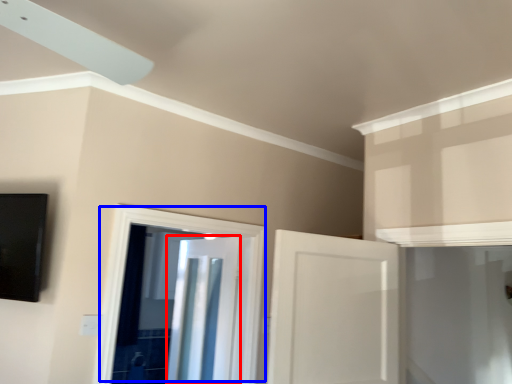
Question: Which point is further to the camera, door (highlighted by a red box) or door (highlighted by a blue box)?

Choices:
 (A) door
 (B) door

Answer: (A)